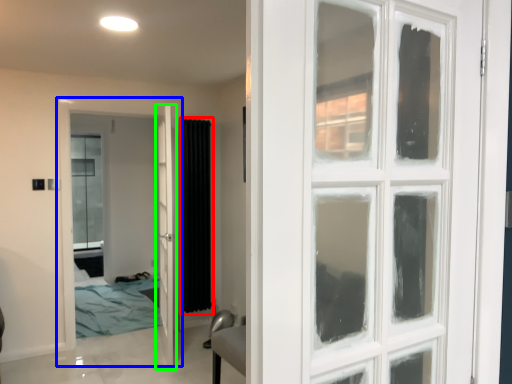
Question: Estimate the real-world distances between objects in this image. Which object is closer to curtain (highlighted by a red box), door (highlighted by a blue box) or door (highlighted by a green box)?

Choices:
 (A) door
 (B) door

Answer: (B)